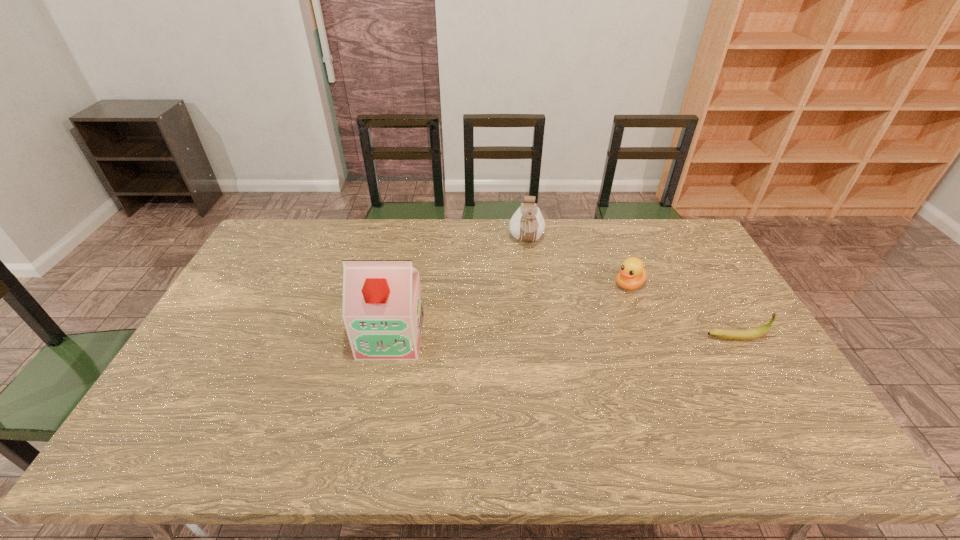
This screenshot has height=540, width=960. Find the location of `vacant space at the far right corner of the desktop`. vacant space at the far right corner of the desktop is located at coordinates (697, 255).

This screenshot has height=540, width=960. What are the coordinates of `vacant space at the near right corner of the desktop` in the screenshot? It's located at (767, 408).

This screenshot has width=960, height=540. Find the location of `unoccupied area between the third nearest object and the farthest object`. unoccupied area between the third nearest object and the farthest object is located at coordinates (578, 263).

Find the location of a particular element. free space between the third shortest object and the second object from right to left is located at coordinates (578, 263).

Locate an element on the screen. The image size is (960, 540). unoccupied position between the rightmost object and the duckling is located at coordinates (683, 311).

The image size is (960, 540). Find the location of `free space between the banana and the tallest object`. free space between the banana and the tallest object is located at coordinates (564, 337).

Identify the location of vacant space that is in between the second object from left to right and the soya milk. Image resolution: width=960 pixels, height=540 pixels. (459, 289).

At what (x,y) coordinates should I click in order to perform the action: click on vacant space in between the soya milk and the pouch. Please return your answer as a coordinate pair (x, y). This screenshot has height=540, width=960. Looking at the image, I should click on (459, 289).

The width and height of the screenshot is (960, 540). What are the coordinates of `blank region between the rightmost object and the tallest object` in the screenshot? It's located at (564, 337).

The height and width of the screenshot is (540, 960). I want to click on free spot between the soya milk and the farthest object, so click(x=459, y=289).